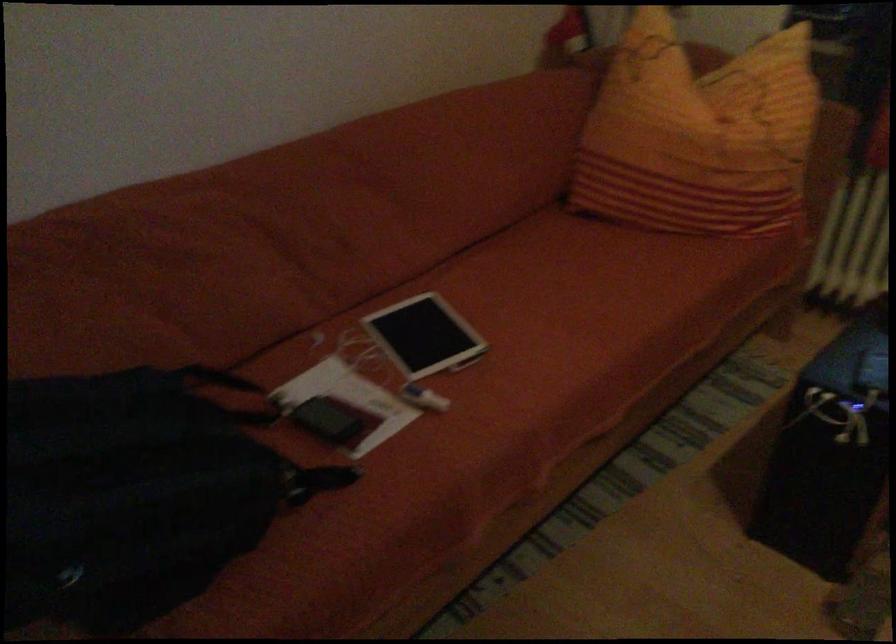
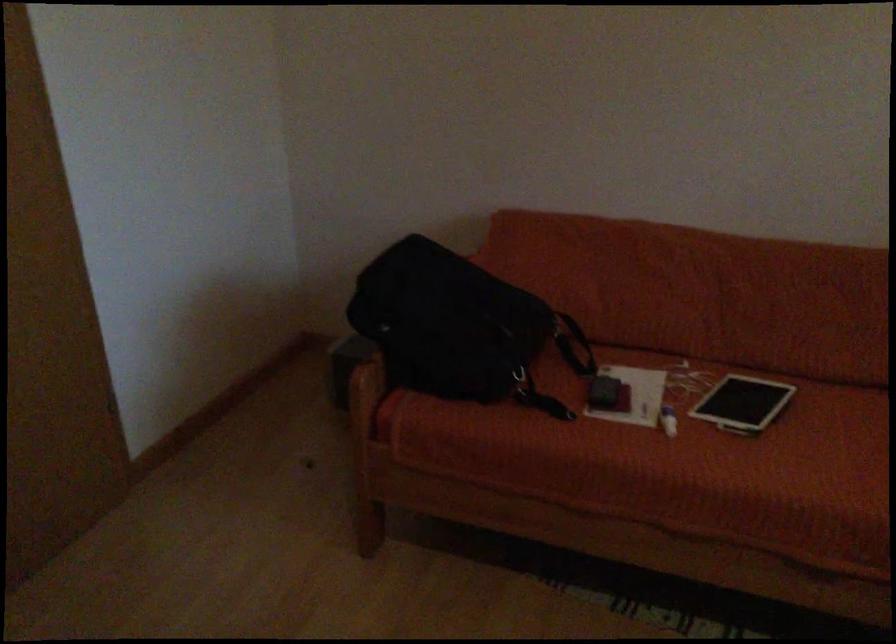
The point at (562, 348) is marked in the first image. Where is the corresponding point in the second image?

(823, 471)